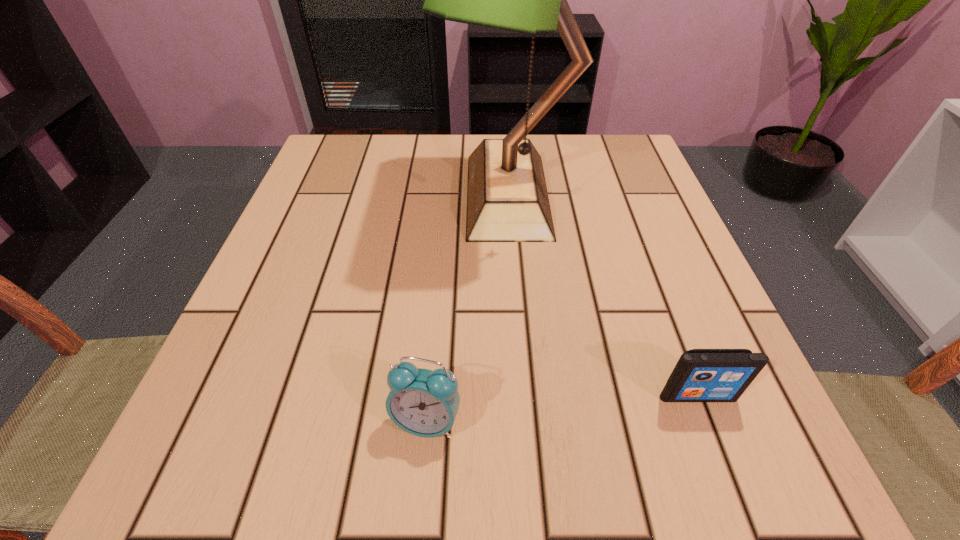
I want to click on object located in the near edge section of the desktop, so click(x=422, y=402).

The width and height of the screenshot is (960, 540). What are the coordinates of `object at the right edge` in the screenshot? It's located at (701, 375).

The width and height of the screenshot is (960, 540). What are the coordinates of `vacant region at the far edge of the desktop` in the screenshot? It's located at pos(564,174).

The width and height of the screenshot is (960, 540). Find the location of `blank space at the near edge of the desktop`. blank space at the near edge of the desktop is located at coordinates (635, 454).

The width and height of the screenshot is (960, 540). What are the coordinates of `vacant space at the left edge of the desktop` in the screenshot? It's located at (306, 421).

Locate an element on the screen. The image size is (960, 540). blank area at the right edge is located at coordinates (601, 199).

In the image, there is a desktop. Where is `vacant space at the far left corner`? vacant space at the far left corner is located at coordinates (329, 148).

Find the location of a particular element. The height and width of the screenshot is (540, 960). vacant region at the near right corner of the desktop is located at coordinates (675, 461).

Locate an element on the screen. The image size is (960, 540). unoccupied position between the table lamp and the shortest object is located at coordinates (603, 295).

Where is `empty location between the alarm clock and the rightmost object`? The image size is (960, 540). empty location between the alarm clock and the rightmost object is located at coordinates (562, 408).